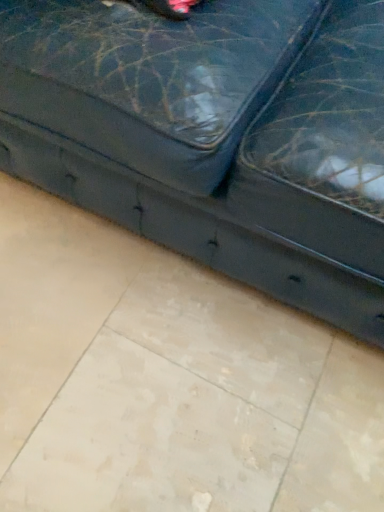
This screenshot has width=384, height=512. What do you see at coordinates (214, 135) in the screenshot?
I see `leather-like black couch at center` at bounding box center [214, 135].

This screenshot has height=512, width=384. What are the coordinates of `leather-like black couch at center` in the screenshot? It's located at (214, 135).

Locate an element on the screen. The image size is (384, 512). leather-like black couch at center is located at coordinates (214, 135).